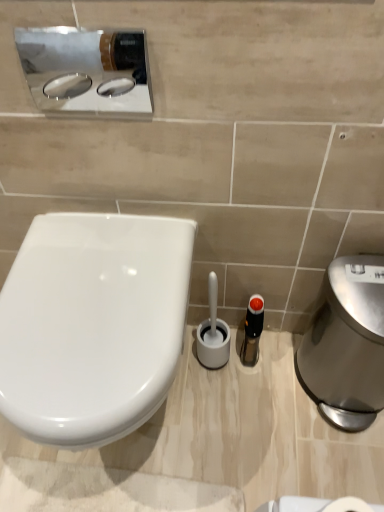
You are a GUI agent. You are given a task and a screenshot of the screen. Output one action in this format:
    pyautogui.click(x=<x>, y=<y>)
    Task: Click on the free space that is in between translucent plastic bottle at center and polished stainless steel hand dryer at right
    This screenshot has width=384, height=512.
    Given the screenshot: What is the action you would take?
    pyautogui.click(x=272, y=374)